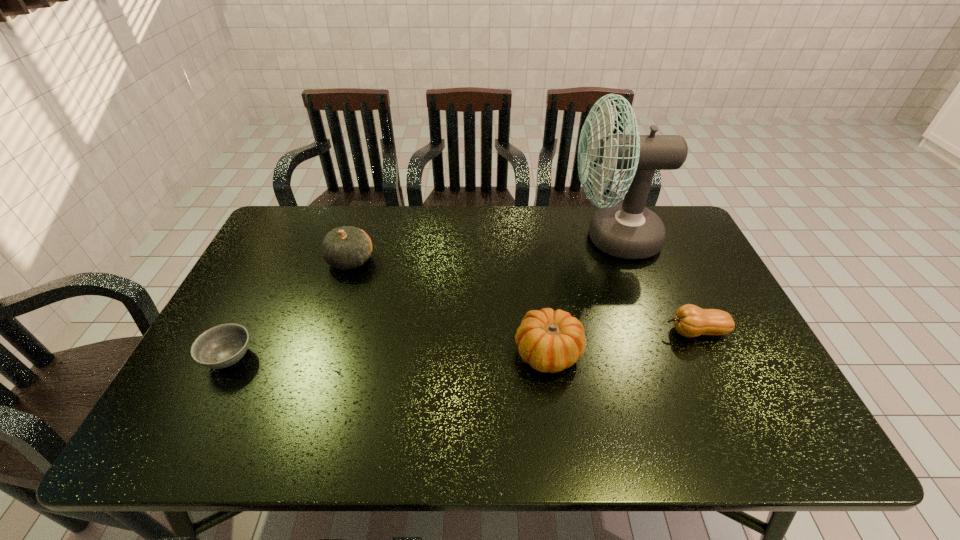
Image resolution: width=960 pixels, height=540 pixels. Find the location of `vacant position located in front of the tallest object where the airflow is directed`. vacant position located in front of the tallest object where the airflow is directed is located at coordinates (459, 238).

The height and width of the screenshot is (540, 960). Identify the location of vacant space located 0.080m on the front of the leftmost gourd. (339, 296).

The width and height of the screenshot is (960, 540). In order to click on free location located 0.310m on the left of the third object from left to right in this screenshot , I will do `click(390, 353)`.

Find the location of `vacant space located on the stem side of the shortest gourd`. vacant space located on the stem side of the shortest gourd is located at coordinates click(x=583, y=332).

Image resolution: width=960 pixels, height=540 pixels. In order to click on free space located 0.130m on the stem side of the shortest gourd in this screenshot , I will do `click(613, 332)`.

Identify the location of free region located on the stem side of the shortest gourd. Image resolution: width=960 pixels, height=540 pixels. (617, 332).

Where is `free spot located 0.250m on the right of the bowl`? free spot located 0.250m on the right of the bowl is located at coordinates (356, 357).

In order to click on fan that is at the far edge in this screenshot , I will do `click(629, 230)`.

Locate an element on the screen. The width and height of the screenshot is (960, 540). gourd located in the far edge section of the desktop is located at coordinates (347, 247).

Where is `object present at the left edge`? The height and width of the screenshot is (540, 960). object present at the left edge is located at coordinates click(x=221, y=346).